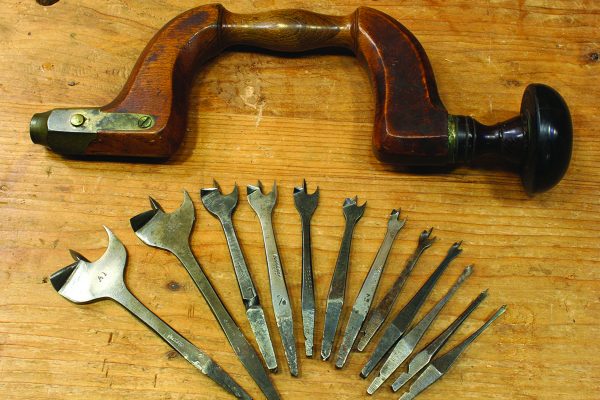
The height and width of the screenshot is (400, 600). Find the location of `scratches in wood`. scratches in wood is located at coordinates (248, 101), (108, 341), (98, 365), (153, 382), (75, 75), (489, 101), (490, 58).